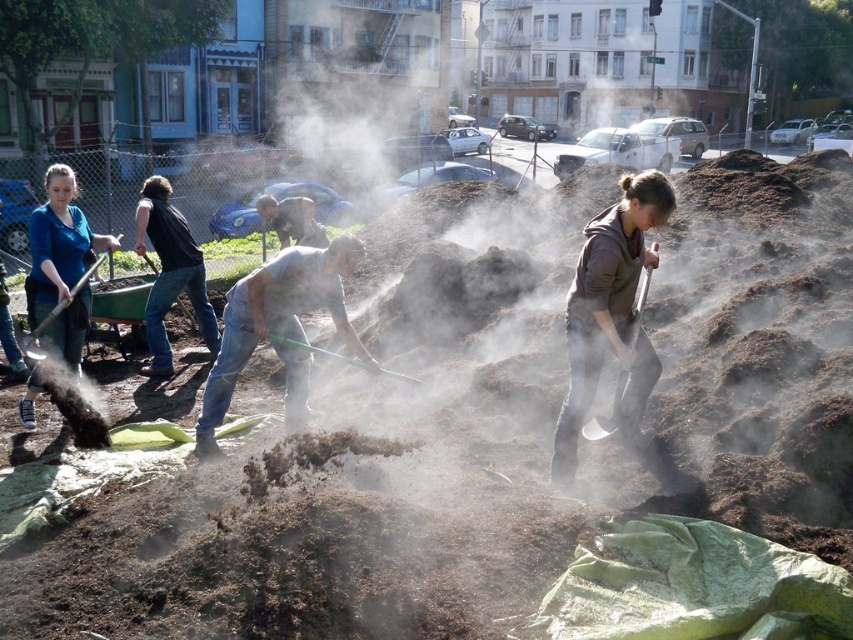
Question: Is brown matte jacket at center smaller than black cotton shirt at center?

Choices:
 (A) no
 (B) yes

Answer: (A)

Question: Which object is closer to the camera taking this photo?

Choices:
 (A) light brown leather jacket at center
 (B) green plastic shovel at center
 (C) black cotton shirt at center
 (D) brown matte jacket at center

Answer: (D)

Question: Based on their relative distances, which object is farther from the gray matte shirt at center?

Choices:
 (A) matte black shovel at lower left
 (B) green plastic shovel at center

Answer: (A)

Question: Is black cotton shirt at center positioned in front of green plastic shovel at center?

Choices:
 (A) no
 (B) yes

Answer: (A)

Question: Which of the following is the farthest from the observer?

Choices:
 (A) metallic silver shovel at lower right
 (B) matte blue shirt at left
 (C) matte black shovel at lower left

Answer: (B)

Question: Can you confirm if gray matte shirt at center is thinner than matte black shovel at lower left?

Choices:
 (A) yes
 (B) no

Answer: (B)